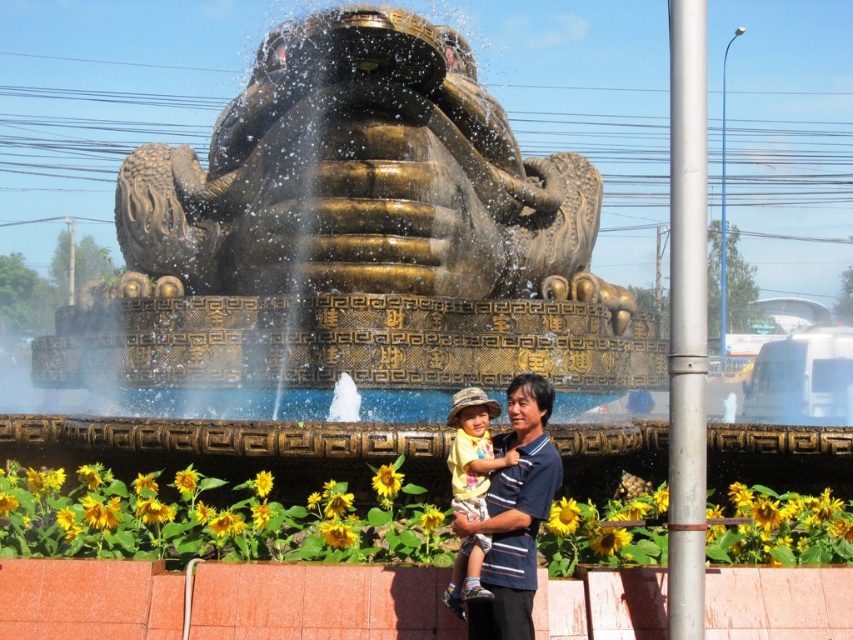
You are standing in the outdoor area and see the point at coordinates (352,244). Based on the scene description, can you determine what object this point is located on?

The point at coordinates (352,244) is located on the gold polished statue at center.

You are a photographer standing at the edge of the fountain. You want to take a picture of both the gold polished statue at center and the yellow cotton shirt at center. Based on their sizes, which object should you focus on first if you want both to be in clear focus?

The gold polished statue at center might be wider than the yellow cotton shirt at center, so it is better to focus on the gold polished statue at center first to ensure both are in clear focus.

You are standing in front of the fountain and see the gold polished statue at center and the yellow cotton shirt at center. Which object is located to the left of the other?

The gold polished statue at center is positioned on the left side of yellow cotton shirt at center.